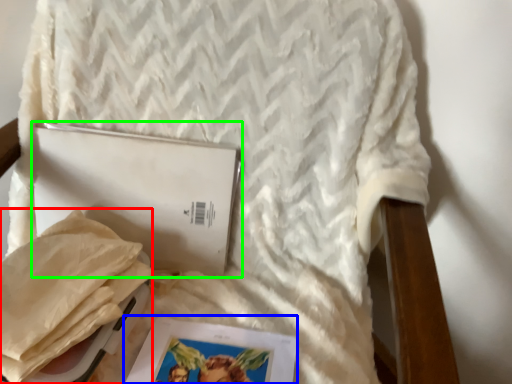
Question: Considering the real-world distances, which object is farthest from material (highlighted by a red box)? magazine (highlighted by a blue box) or journal (highlighted by a green box)?

Choices:
 (A) magazine
 (B) journal

Answer: (A)